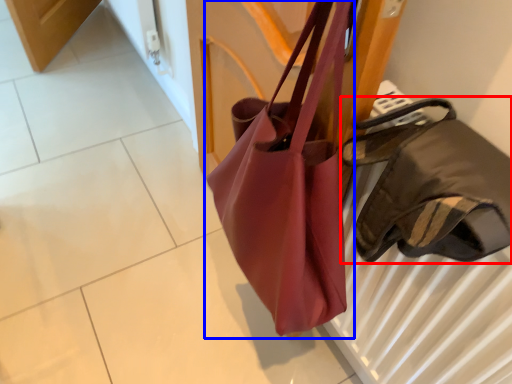
Question: Which object is closer to the camera taking this photo, handbag (highlighted by a red box) or handbag (highlighted by a blue box)?

Choices:
 (A) handbag
 (B) handbag

Answer: (A)